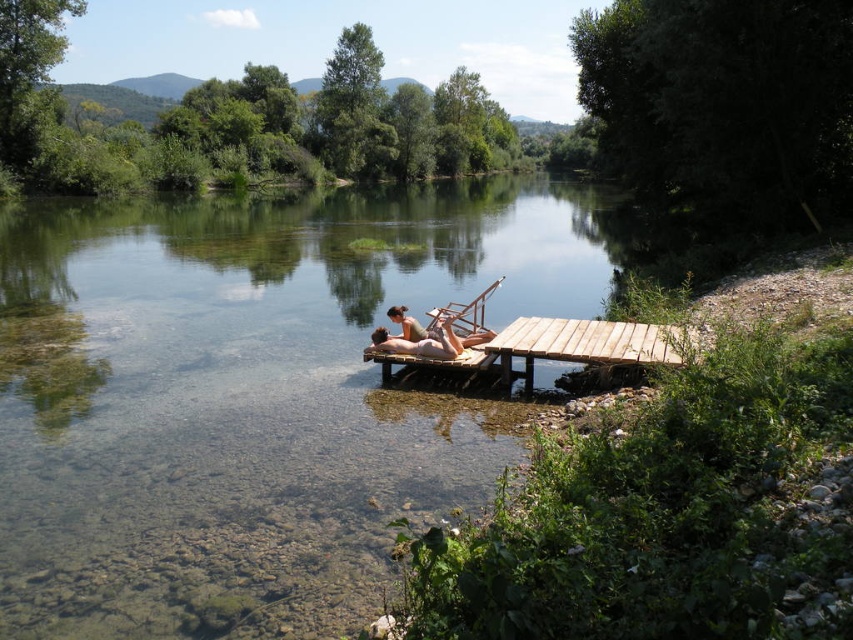
You are a photographer trying to capture the clear water at center and smooth tan skin at center in a single shot. Based on their positions, which object should you focus on first to ensure both are in frame?

The clear water at center is positioned on the left side of smooth tan skin at center. To capture both in a single shot, focus on the clear water at center first as it is on the left, ensuring the smooth tan skin at center remains within the frame to the right.

You are standing at the riverside and see the point marked as point (189, 344). Can you reach this point without getting wet?

The point (189, 344) is 12.28 meters away from viewer, so yes, you can reach it without getting wet as it is within a reasonable distance on the riverside.

You are standing at the point marked as point (x=585, y=342). What is the closest object to you?

The closest object to you is the wooden dock at center, as the point (x=585, y=342) is located on it.